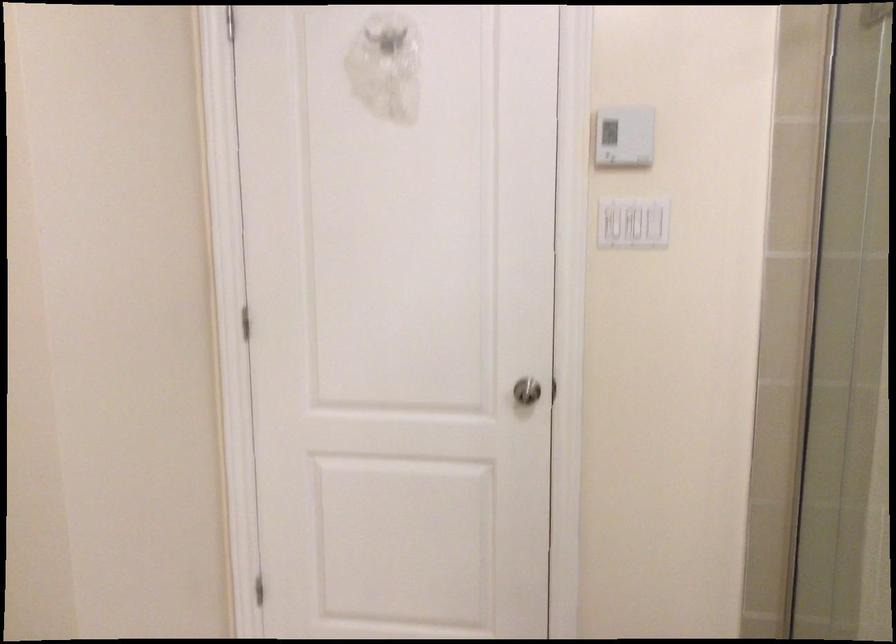
Locate an element on the screen. Image resolution: width=896 pixels, height=644 pixels. white thermostat is located at coordinates [x=624, y=136].